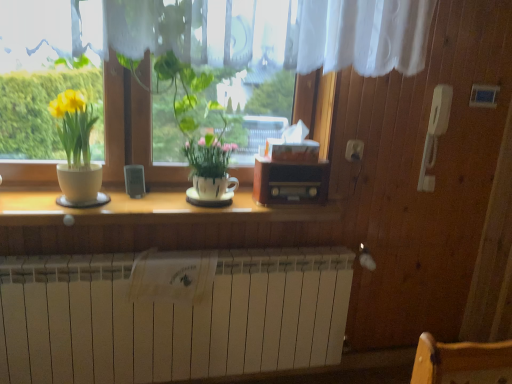
Question: Is white matte radiator at lower center positioned in front of wooden radio at center?

Choices:
 (A) no
 (B) yes

Answer: (B)

Question: Is white matte radiator at lower center wider than wooden radio at center?

Choices:
 (A) yes
 (B) no

Answer: (A)

Question: Considering the relative sizes of white matte radiator at lower center and wooden radio at center in the image provided, is white matte radiator at lower center shorter than wooden radio at center?

Choices:
 (A) yes
 (B) no

Answer: (B)

Question: Is white matte radiator at lower center bigger than wooden radio at center?

Choices:
 (A) yes
 (B) no

Answer: (A)

Question: Does white matte radiator at lower center touch wooden radio at center?

Choices:
 (A) yes
 (B) no

Answer: (B)

Question: In terms of size, does white glossy pot at center, which ranks as the 2th houseplant in left-to-right order, appear bigger or smaller than white matte radiator at lower center?

Choices:
 (A) small
 (B) big

Answer: (A)

Question: Relative to white matte radiator at lower center, is white glossy pot at center, marked as the 1th houseplant in a right-to-left arrangement, in front or behind?

Choices:
 (A) front
 (B) behind

Answer: (A)

Question: Is white glossy pot at center, which ranks as the 2th houseplant in left-to-right order, taller or shorter than white matte radiator at lower center?

Choices:
 (A) tall
 (B) short

Answer: (B)

Question: Choose the correct answer: Is white glossy pot at center, marked as the 1th houseplant in a right-to-left arrangement, inside white matte radiator at lower center or outside it?

Choices:
 (A) outside
 (B) inside

Answer: (A)

Question: From a real-world perspective, relative to wooden counter top at center, is white glossy pot at center, which ranks as the 2th houseplant in left-to-right order, vertically above or below?

Choices:
 (A) below
 (B) above

Answer: (B)

Question: Is point (186, 157) closer or farther from the camera than point (29, 193)?

Choices:
 (A) farther
 (B) closer

Answer: (A)

Question: Relative to wooden counter top at center, is white glossy pot at center, marked as the 1th houseplant in a right-to-left arrangement, in front or behind?

Choices:
 (A) front
 (B) behind

Answer: (A)

Question: Would you say white glossy pot at center, which ranks as the 2th houseplant in left-to-right order, is to the left or to the right of wooden counter top at center in the picture?

Choices:
 (A) left
 (B) right

Answer: (B)

Question: Is matte white pot at left, the 2th houseplant viewed from the right, taller or shorter than wooden radio at center?

Choices:
 (A) short
 (B) tall

Answer: (B)

Question: Is matte white pot at left, the 1th houseplant when ordered from left to right, inside the boundaries of wooden radio at center, or outside?

Choices:
 (A) inside
 (B) outside

Answer: (B)